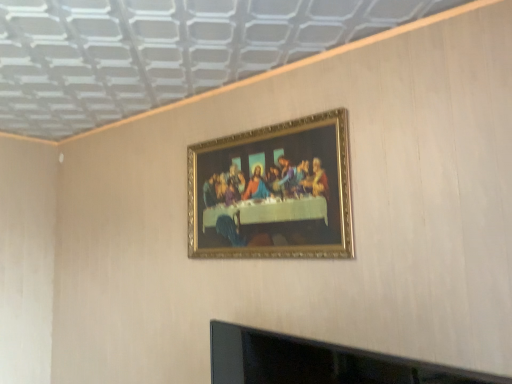
The image size is (512, 384). I want to click on gold/gilded picture frame at upper center, so click(x=273, y=192).

Describe the element at coordinates (273, 192) in the screenshot. I see `gold/gilded picture frame at upper center` at that location.

Identify the location of gold/gilded picture frame at upper center. The width and height of the screenshot is (512, 384). click(273, 192).